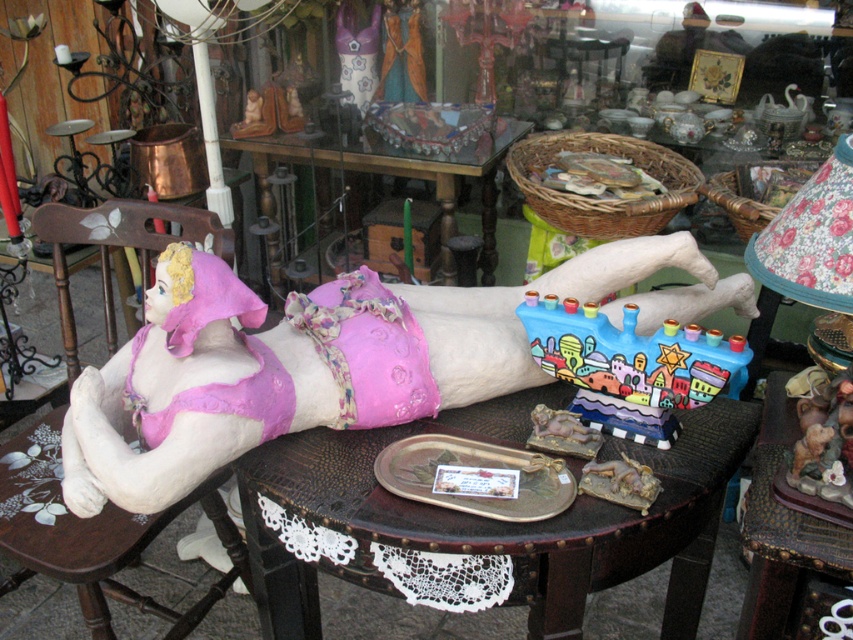
The image size is (853, 640). Find the location of `pink fabric doll at center`. pink fabric doll at center is located at coordinates (154, 413).

Between point (508, 388) and point (779, 401), which one is positioned in front?

Point (779, 401) is in front.

Where is `pink fabric doll at center`? The width and height of the screenshot is (853, 640). pink fabric doll at center is located at coordinates (154, 413).

Can you confirm if leather-like dark brown table at center is shorter than wooden chair at left?

No, leather-like dark brown table at center is not shorter than wooden chair at left.

Measure the distance between leather-like dark brown table at center and camera.

1.19 meters

Is point (506, 404) farther from camera compared to point (86, 534)?

No, it is in front of (86, 534).

Image resolution: width=853 pixels, height=640 pixels. Identify the location of leather-like dark brown table at center. (494, 518).

Is wooden table at center thinner than glass/marble table at center?

Correct, wooden table at center's width is less than glass/marble table at center's.

Looking at this image, does wooden table at center lie behind glass/marble table at center?

No, it is not.

Is point (811, 504) farther from camera compared to point (234, 148)?

No, (811, 504) is in front of (234, 148).

Locate an element on the screen. The width and height of the screenshot is (853, 640). wooden table at center is located at coordinates (787, 536).